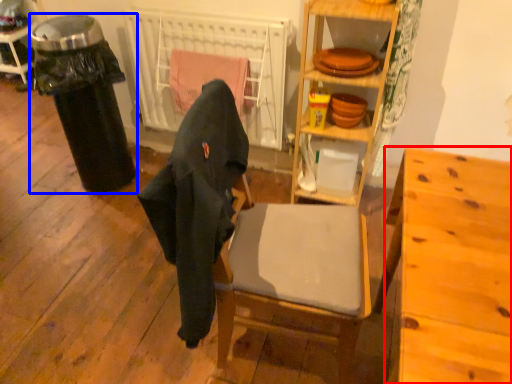
Question: Which object is further to the camera taking this photo, desk (highlighted by a red box) or garbage (highlighted by a blue box)?

Choices:
 (A) desk
 (B) garbage

Answer: (B)